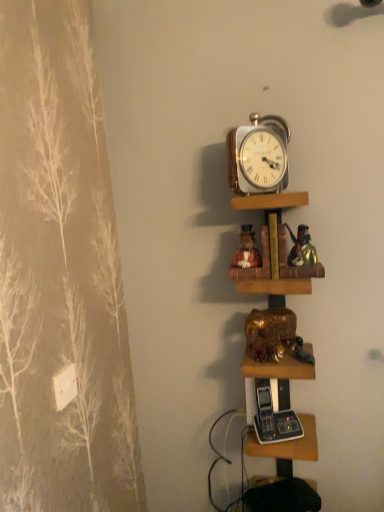
Question: Is gold metallic elephant at center to the right of wooden shelves at center, positioned as the second shelf in top-to-bottom order, from the viewer's perspective?

Choices:
 (A) yes
 (B) no

Answer: (B)

Question: Considering the relative sizes of gold metallic elephant at center and wooden shelves at center, positioned as the second shelf in top-to-bottom order, in the image provided, is gold metallic elephant at center wider than wooden shelves at center, positioned as the second shelf in top-to-bottom order,?

Choices:
 (A) no
 (B) yes

Answer: (A)

Question: Is gold metallic elephant at center with wooden shelves at center, positioned as the second shelf in top-to-bottom order?

Choices:
 (A) yes
 (B) no

Answer: (B)

Question: From the image's perspective, is gold metallic elephant at center below wooden shelves at center, positioned as the second shelf in top-to-bottom order?

Choices:
 (A) yes
 (B) no

Answer: (B)

Question: Can you confirm if gold metallic elephant at center is taller than wooden shelves at center, positioned as the second shelf in top-to-bottom order?

Choices:
 (A) no
 (B) yes

Answer: (A)

Question: From a real-world perspective, is gold metallic elephant at center located beneath wooden shelves at center, positioned as the 1th shelf in bottom-to-top order?

Choices:
 (A) no
 (B) yes

Answer: (A)

Question: Considering the relative sizes of wooden shelves at center, positioned as the second shelf in top-to-bottom order, and matte ceramic figurines at center, arranged as the first shelf when viewed from the top, in the image provided, is wooden shelves at center, positioned as the second shelf in top-to-bottom order, wider than matte ceramic figurines at center, arranged as the first shelf when viewed from the top,?

Choices:
 (A) yes
 (B) no

Answer: (A)

Question: Does wooden shelves at center, positioned as the 1th shelf in bottom-to-top order, have a greater height compared to matte ceramic figurines at center, arranged as the first shelf when viewed from the top?

Choices:
 (A) no
 (B) yes

Answer: (B)

Question: From the image's perspective, does wooden shelves at center, positioned as the 1th shelf in bottom-to-top order, appear lower than matte ceramic figurines at center, arranged as the first shelf when viewed from the top?

Choices:
 (A) yes
 (B) no

Answer: (A)

Question: Are wooden shelves at center, positioned as the 1th shelf in bottom-to-top order, and matte ceramic figurines at center, arranged as the first shelf when viewed from the top, far apart?

Choices:
 (A) no
 (B) yes

Answer: (A)

Question: Is the position of wooden shelves at center, positioned as the second shelf in top-to-bottom order, less distant than that of matte ceramic figurines at center, arranged as the first shelf when viewed from the top?

Choices:
 (A) no
 (B) yes

Answer: (B)

Question: Is wooden shelves at center, positioned as the second shelf in top-to-bottom order, positioned behind matte ceramic figurines at center, the 2th shelf from the bottom?

Choices:
 (A) yes
 (B) no

Answer: (B)

Question: Can you confirm if matte ceramic figurines at center, the 2th shelf from the bottom, is positioned to the right of gold metallic alarm clock at upper center?

Choices:
 (A) no
 (B) yes

Answer: (B)